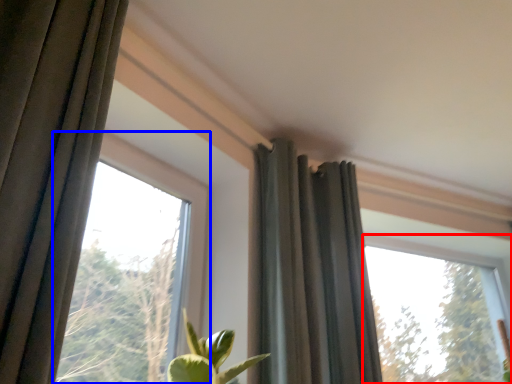
Question: Which object is further to the camera taking this photo, window (highlighted by a red box) or window (highlighted by a blue box)?

Choices:
 (A) window
 (B) window

Answer: (A)